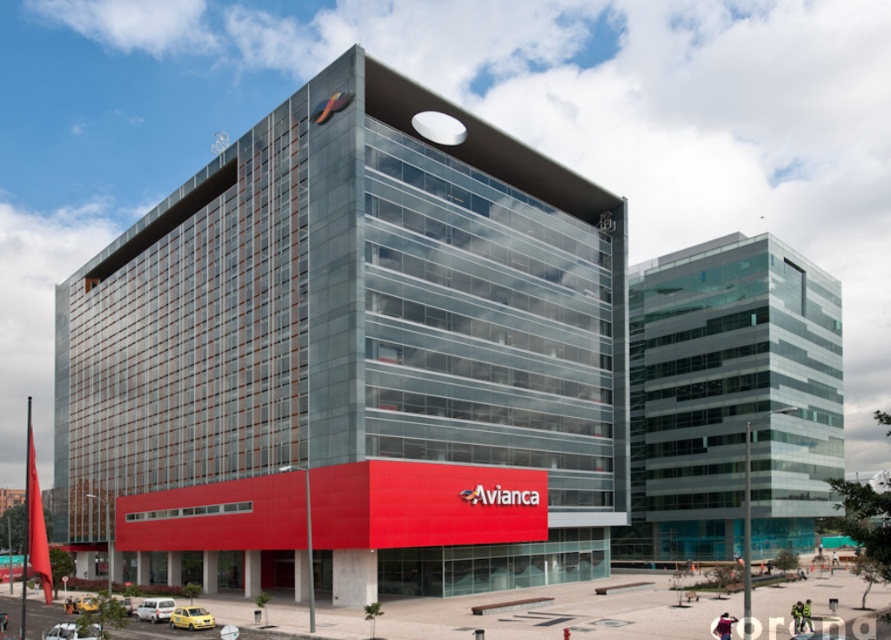
Question: Which object is closer to the camera taking this photo?

Choices:
 (A) glassy modern building at center
 (B) transparent glass building at center

Answer: (A)

Question: Can you confirm if glassy modern building at center is positioned to the right of transparent glass building at center?

Choices:
 (A) no
 (B) yes

Answer: (A)

Question: Does glassy modern building at center lie behind transparent glass building at center?

Choices:
 (A) yes
 (B) no

Answer: (B)

Question: Which point is farther from the camera taking this photo?

Choices:
 (A) (779, 312)
 (B) (473, 476)

Answer: (A)

Question: Does glassy modern building at center have a larger size compared to transparent glass building at center?

Choices:
 (A) no
 (B) yes

Answer: (B)